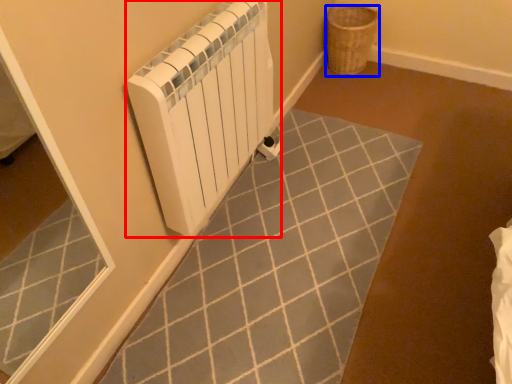
Question: Which object appears closest to the camera in this image, bath heater (highlighted by a red box) or basket (highlighted by a blue box)?

Choices:
 (A) bath heater
 (B) basket

Answer: (A)